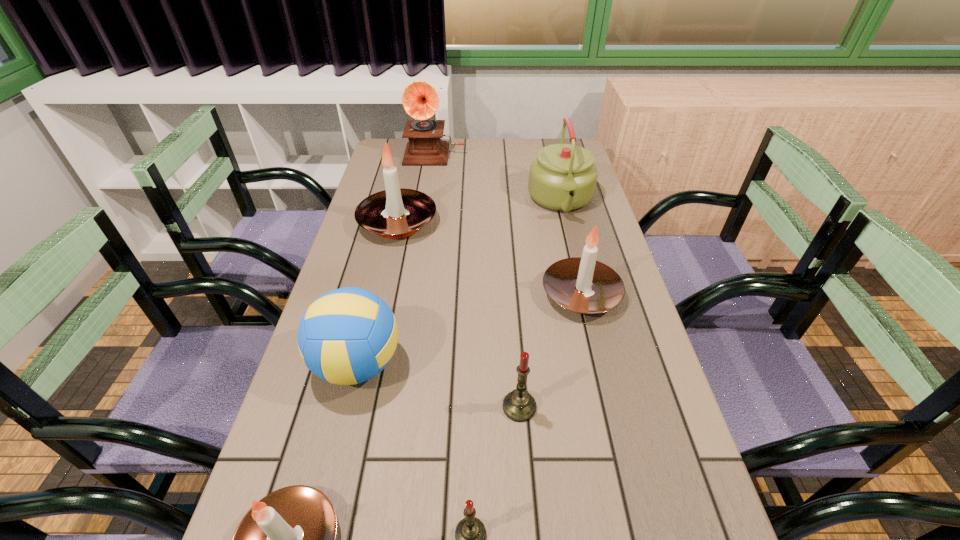
I want to click on empty space that is in between the farthest object and the second farthest white candle, so click(508, 224).

Identify which object is located as the third nearest to the bigger red candle. Please provide its 2D coordinates. Your answer should be formatted as a tuple, i.e. [(x, y)], where the tuple contains the x and y coordinates of a point satisfying the conditions above.

[(347, 336)]

Find the location of a particular element. The image size is (960, 540). object that stands as the third closest to the nearer red candle is located at coordinates pos(347,336).

Select which candle is the third closest to the fourth farthest object. Please provide its 2D coordinates. Your answer should be formatted as a tuple, i.e. [(x, y)], where the tuple contains the x and y coordinates of a point satisfying the conditions above.

[(470, 533)]

Where is `candle that stands as the second closest to the phonograph record`? Image resolution: width=960 pixels, height=540 pixels. candle that stands as the second closest to the phonograph record is located at coordinates (583, 285).

The height and width of the screenshot is (540, 960). Find the location of `white candle that can be found as the closest to the smallest white candle`. white candle that can be found as the closest to the smallest white candle is located at coordinates (583, 285).

Identify the location of white candle that is the closest to the smallest white candle. The height and width of the screenshot is (540, 960). (583, 285).

Find the location of a particular element. vacant region that satisfies the following two spatial constraints: 1. on the horn of the phonograph record; 2. on the left side of the third farthest candle is located at coordinates (396, 407).